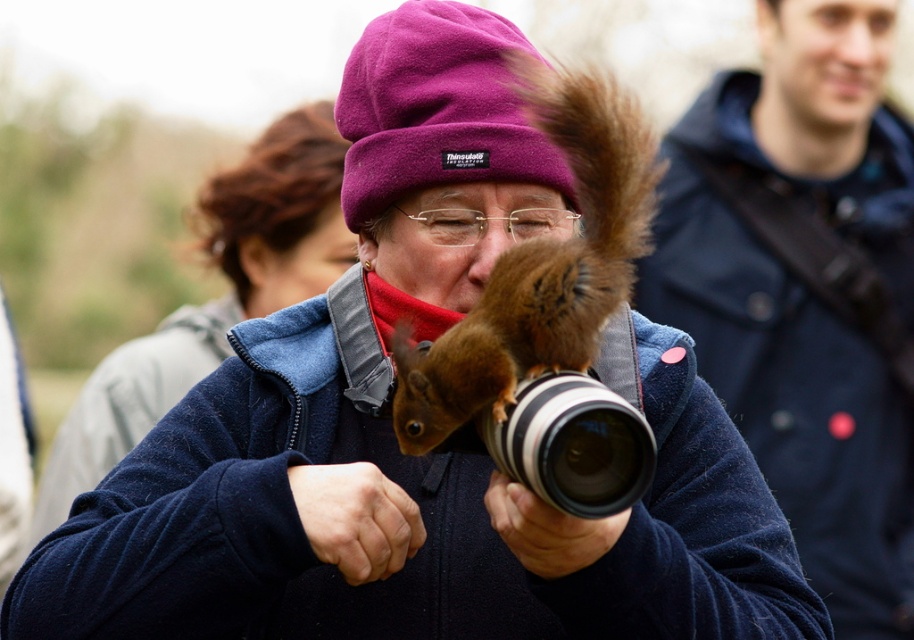
Looking at this image, you are a photographer trying to capture a group photo of the dark blue jacket at upper right and the purple fleece beanie at center. Given that your camera has a maximum focus range of 8 feet, will you be able to include both subjects in the shot?

The distance between the dark blue jacket at upper right and the purple fleece beanie at center is 7.82 feet, which is within the camera lens focus range of 8 feet. Therefore, both subjects can be captured in the same focused shot.

You are a photographer trying to capture a closeup of the dark blue jacket at upper right. What coordinates should you focus on to ensure the jacket is in the center of your shot?

The dark blue jacket at upper right is located at coordinates point (806, 289), so you should focus your camera there to center it in your shot.